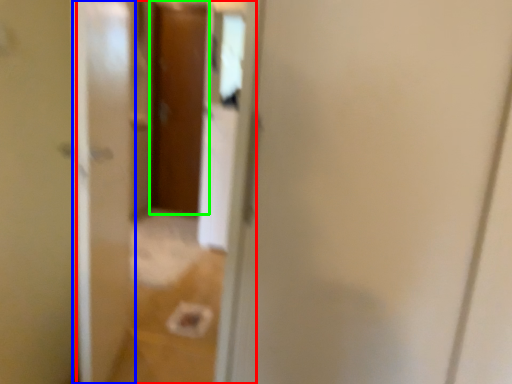
Question: Which object is positioned closest to glass door (highlighted by a red box)? Select from screen door (highlighted by a blue box) and door (highlighted by a green box).

Choices:
 (A) screen door
 (B) door

Answer: (A)